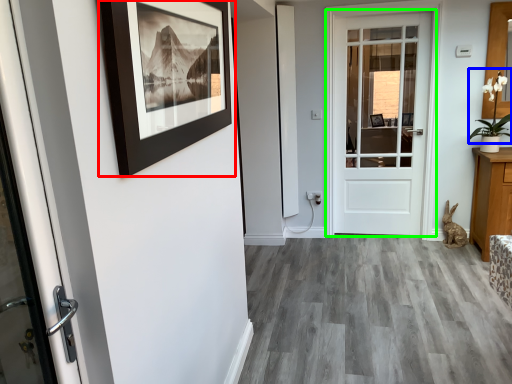
Question: Estimate the real-world distances between objects in this image. Which object is farther from picture frame (highlighted by a red box), plant (highlighted by a blue box) or door (highlighted by a green box)?

Choices:
 (A) plant
 (B) door

Answer: (A)